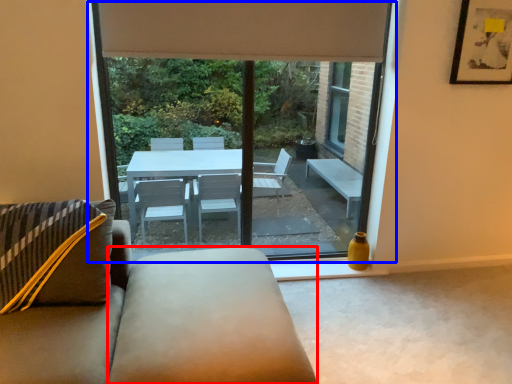
Question: Which point is closer to the camera, flat (highlighted by a red box) or window (highlighted by a blue box)?

Choices:
 (A) flat
 (B) window

Answer: (A)